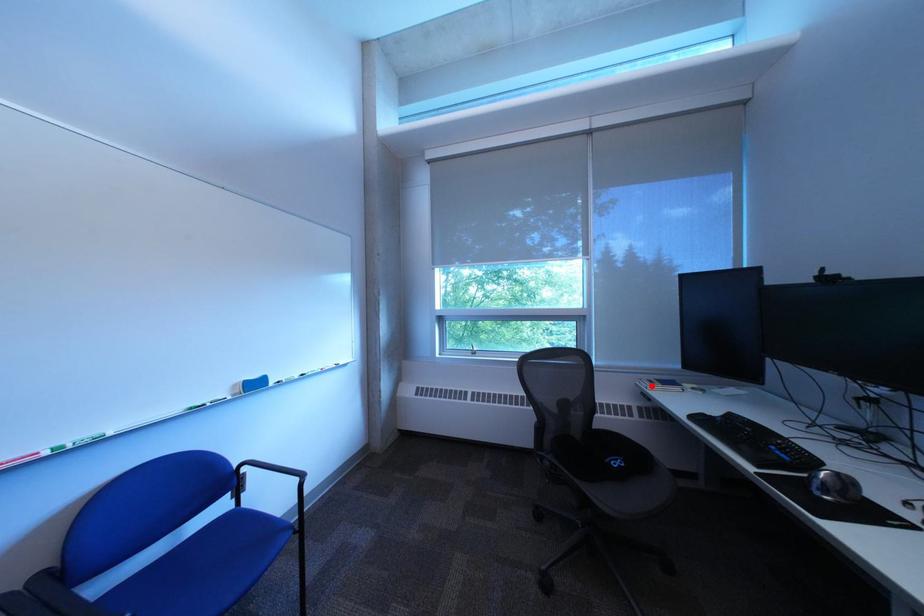
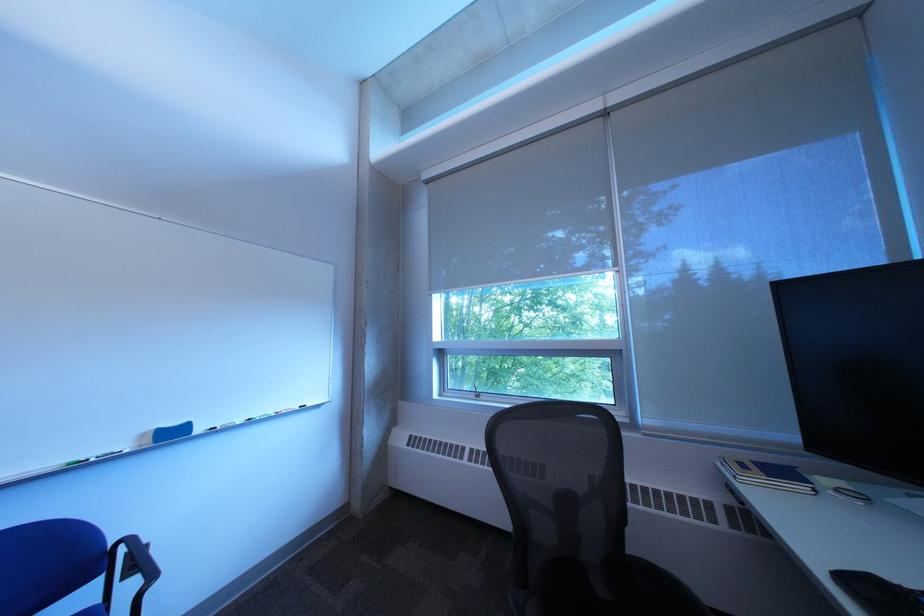
In the second image, find the point that corresponds to the highlighted location in the first image.

(733, 468)